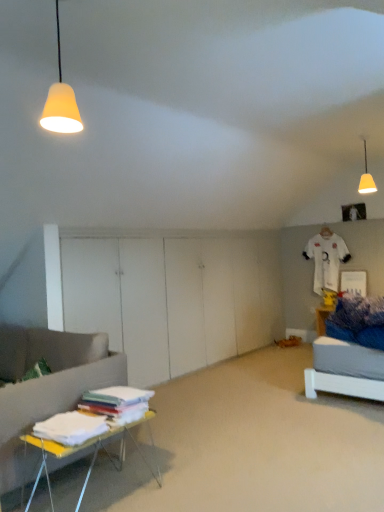
Describe the element at coordinates (61, 102) in the screenshot. I see `matte yellow cone at upper left, arranged as the second lamp when viewed from the back` at that location.

At what (x,y) coordinates should I click in order to perform the action: click on matte yellow lampshade at upper right, acting as the second lamp starting from the left. Please return your answer as a coordinate pair (x, y). This screenshot has width=384, height=512. Looking at the image, I should click on pyautogui.click(x=366, y=177).

At what (x,y) coordinates should I click in order to perform the action: click on white plastic table at lower left. Please return your answer as a coordinate pair (x, y). This screenshot has width=384, height=512. Looking at the image, I should click on (93, 453).

Which of these two, white plastic table at lower left or matte yellow lampshade at upper right, acting as the second lamp starting from the left, is smaller?

Smaller between the two is matte yellow lampshade at upper right, acting as the second lamp starting from the left.

Between white plastic table at lower left and matte yellow lampshade at upper right, acting as the second lamp starting from the left, which one appears on the right side from the viewer's perspective?

From the viewer's perspective, matte yellow lampshade at upper right, acting as the second lamp starting from the left, appears more on the right side.

Considering the sizes of white plastic table at lower left and matte yellow lampshade at upper right, which is the 1th lamp from back to front, in the image, is white plastic table at lower left wider or thinner than matte yellow lampshade at upper right, which is the 1th lamp from back to front,?

Considering their sizes, white plastic table at lower left looks broader than matte yellow lampshade at upper right, which is the 1th lamp from back to front.

Looking at this image, is the surface of matte yellow lampshade at upper right, which is the 1th lamp from back to front, in direct contact with white cotton sheets at lower left?

matte yellow lampshade at upper right, which is the 1th lamp from back to front, is not next to white cotton sheets at lower left, and they're not touching.

From the picture: From a real-world perspective, is matte yellow lampshade at upper right, acting as the second lamp starting from the left, over white cotton sheets at lower left?

Correct, in the physical world, matte yellow lampshade at upper right, acting as the second lamp starting from the left, is higher than white cotton sheets at lower left.

Which object is further away from the camera, matte yellow lampshade at upper right, the 1th lamp from the right, or white cotton sheets at lower left?

matte yellow lampshade at upper right, the 1th lamp from the right, is further away from the camera.

Considering the sizes of matte yellow lampshade at upper right, acting as the second lamp starting from the left, and white cotton sheets at lower left in the image, is matte yellow lampshade at upper right, acting as the second lamp starting from the left, taller or shorter than white cotton sheets at lower left?

A: matte yellow lampshade at upper right, acting as the second lamp starting from the left, is taller than white cotton sheets at lower left.

From a real-world perspective, is matte yellow cone at upper left, arranged as the second lamp when viewed from the back, located beneath white plastic table at lower left?

No, from a real-world perspective, matte yellow cone at upper left, arranged as the second lamp when viewed from the back, is not below white plastic table at lower left.

From the image's perspective, is matte yellow cone at upper left, the 1th lamp viewed from the left, located above white plastic table at lower left?

Yes, from the image's perspective, matte yellow cone at upper left, the 1th lamp viewed from the left, is above white plastic table at lower left.

Which is in front, point (74, 118) or point (43, 469)?

Positioned in front is point (74, 118).

Is the position of white cotton sheets at lower left more distant than that of white plastic table at lower left?

Yes.

Which of these two, white cotton sheets at lower left or white plastic table at lower left, stands shorter?

white cotton sheets at lower left.

From the image's perspective, relative to white plastic table at lower left, is white cotton sheets at lower left above or below?

From the image's perspective, white cotton sheets at lower left appears above white plastic table at lower left.

Is point (332, 429) closer or farther from the camera than point (369, 174)?

Point (332, 429).

Does white fabric stack at lower left have a greater width compared to matte yellow lampshade at upper right, which is the 1th lamp from back to front?

Yes.

Is white fabric stack at lower left oriented away from matte yellow lampshade at upper right, the second lamp viewed from the front?

white fabric stack at lower left is not turned away from matte yellow lampshade at upper right, the second lamp viewed from the front.

Does white fabric stack at lower left lie behind matte yellow lampshade at upper right, the second lamp viewed from the front?

That is False.

Considering the sizes of objects white cotton sheets at lower left and white fabric stack at lower left in the image provided, who is shorter, white cotton sheets at lower left or white fabric stack at lower left?

white cotton sheets at lower left.

Between white cotton sheets at lower left and white fabric stack at lower left, which one is positioned behind?

white cotton sheets at lower left is further from the camera.

In the scene shown: Is white cotton sheets at lower left located outside white fabric stack at lower left?

Indeed, white cotton sheets at lower left is completely outside white fabric stack at lower left.

Is matte yellow lampshade at upper right, acting as the second lamp starting from the left, surrounded by matte yellow cone at upper left, arranged as the second lamp when viewed from the back?

No, matte yellow lampshade at upper right, acting as the second lamp starting from the left, is not a part of matte yellow cone at upper left, arranged as the second lamp when viewed from the back.

Considering the sizes of objects matte yellow cone at upper left, the 1th lamp viewed from the left, and matte yellow lampshade at upper right, which is the 1th lamp from back to front, in the image provided, who is thinner, matte yellow cone at upper left, the 1th lamp viewed from the left, or matte yellow lampshade at upper right, which is the 1th lamp from back to front,?

matte yellow cone at upper left, the 1th lamp viewed from the left.

From a real-world perspective, is matte yellow cone at upper left, the 2th lamp from the right, physically located above or below matte yellow lampshade at upper right, the 1th lamp from the right?

Clearly, from a real-world perspective, matte yellow cone at upper left, the 2th lamp from the right, is below matte yellow lampshade at upper right, the 1th lamp from the right.

Find the location of a particular element. This screenshot has width=384, height=512. lamp on the left of matte yellow lampshade at upper right, the second lamp viewed from the front is located at coordinates (61, 102).

The width and height of the screenshot is (384, 512). In order to click on table on the left of matte yellow lampshade at upper right, the 1th lamp from the right in this screenshot , I will do `click(93, 453)`.

Locate an element on the screen. The height and width of the screenshot is (512, 384). sheet below the matte yellow lampshade at upper right, the 1th lamp from the right (from a real-world perspective) is located at coordinates (71, 426).

From the image, which object appears to be farther from matte yellow cone at upper left, the 2th lamp from the right, white cotton sheets at lower left or matte yellow lampshade at upper right, which is the 1th lamp from back to front?

matte yellow lampshade at upper right, which is the 1th lamp from back to front.

From the image, which object appears to be nearer to white plastic table at lower left, matte yellow lampshade at upper right, acting as the second lamp starting from the left, or white fabric stack at lower left?

The object closer to white plastic table at lower left is white fabric stack at lower left.

Consider the image. When comparing their distances from matte yellow lampshade at upper right, which is the 1th lamp from back to front, does white fabric stack at lower left or matte yellow cone at upper left, the 2th lamp from the right, seem further?

Based on the image, matte yellow cone at upper left, the 2th lamp from the right, appears to be further to matte yellow lampshade at upper right, which is the 1th lamp from back to front.

Based on their spatial positions, is white cotton sheets at lower left or matte yellow lampshade at upper right, the 1th lamp from the right, further from white fabric stack at lower left?

matte yellow lampshade at upper right, the 1th lamp from the right, is further to white fabric stack at lower left.

Estimate the real-world distances between objects in this image. Which object is further from matte yellow cone at upper left, arranged as the second lamp when viewed from the back, matte yellow lampshade at upper right, the 1th lamp from the right, or white cotton sheets at lower left?

matte yellow lampshade at upper right, the 1th lamp from the right, is further to matte yellow cone at upper left, arranged as the second lamp when viewed from the back.

In the scene shown: Looking at the image, which one is located closer to matte yellow lampshade at upper right, acting as the second lamp starting from the left, white fabric stack at lower left or white cotton sheets at lower left?

white fabric stack at lower left lies closer to matte yellow lampshade at upper right, acting as the second lamp starting from the left, than the other object.

Estimate the real-world distances between objects in this image. Which object is closer to white cotton sheets at lower left, matte yellow cone at upper left, the 1th lamp viewed from the left, or white plastic table at lower left?

white plastic table at lower left.

From the image, which object appears to be nearer to white plastic table at lower left, white fabric stack at lower left or matte yellow cone at upper left, positioned as the first lamp in front-to-back order?

white fabric stack at lower left is positioned closer to the anchor white plastic table at lower left.

Locate an element on the screen. The height and width of the screenshot is (512, 384). sheet between matte yellow cone at upper left, arranged as the second lamp when viewed from the back, and white plastic table at lower left in the up-down direction is located at coordinates (71, 426).

Find the location of a particular element. This screenshot has height=512, width=384. lamp located between white fabric stack at lower left and matte yellow lampshade at upper right, the 1th lamp from the right, in the depth direction is located at coordinates (61, 102).

At what (x,y) coordinates should I click in order to perform the action: click on lamp located between white cotton sheets at lower left and matte yellow lampshade at upper right, which is the 1th lamp from back to front, in the left-right direction. Please return your answer as a coordinate pair (x, y). Looking at the image, I should click on (61, 102).

The width and height of the screenshot is (384, 512). I want to click on table located between white cotton sheets at lower left and matte yellow lampshade at upper right, the 1th lamp from the right, in the left-right direction, so click(93, 453).